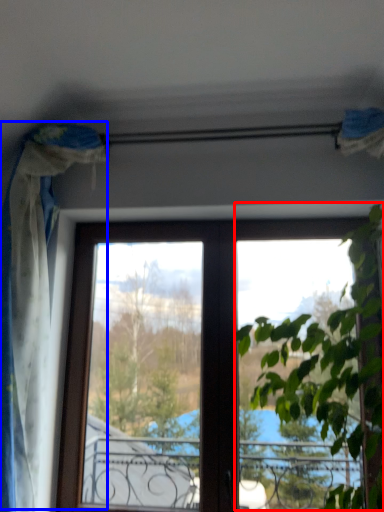
Question: Which of the following is the farthest to the observer, vegetation (highlighted by a red box) or curtain (highlighted by a blue box)?

Choices:
 (A) vegetation
 (B) curtain

Answer: (B)